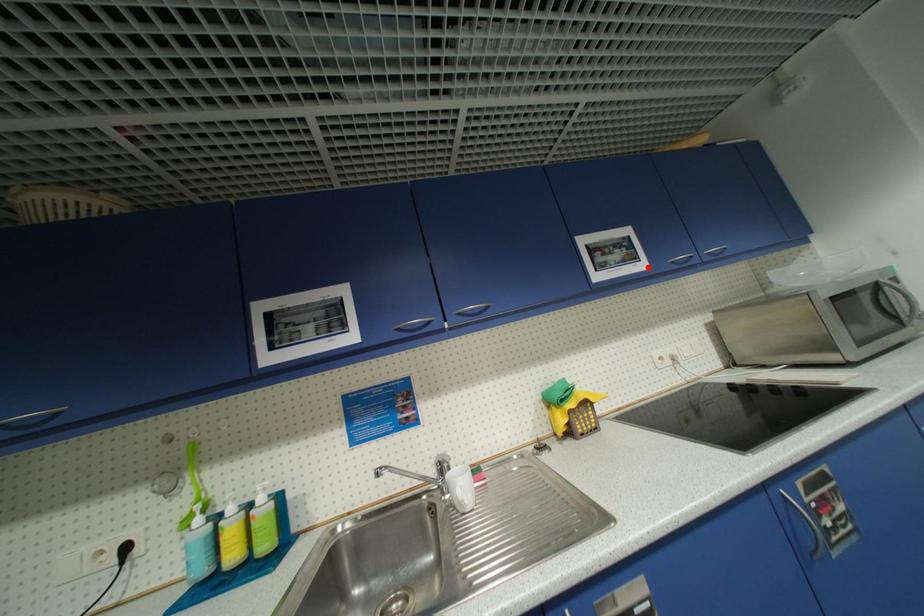
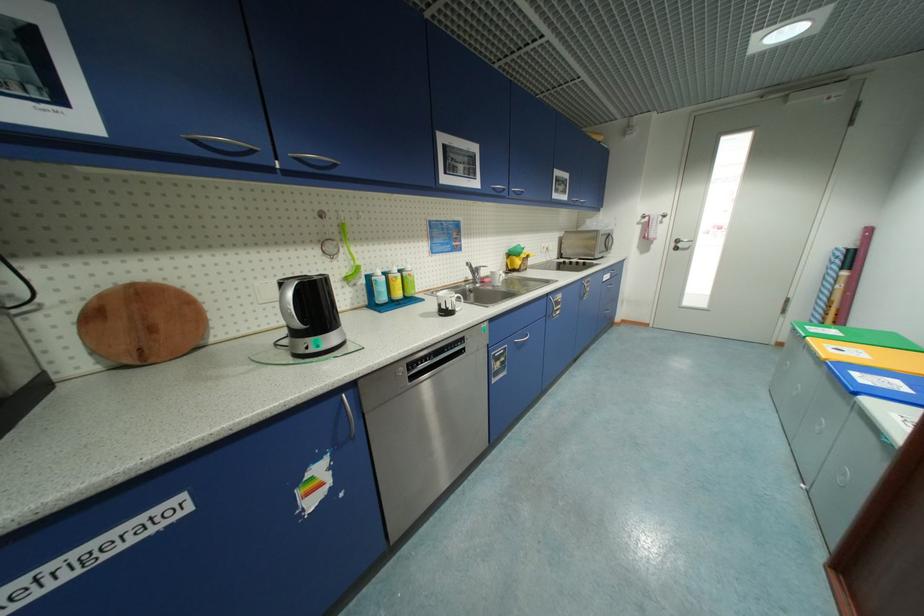
Find the pixel in the second image that matches the highlighted location in the first image.

(570, 199)